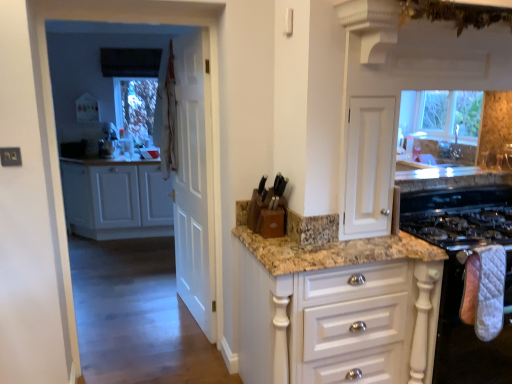
Question: Is white quilted oven mitt at lower right shorter than wooden knife block at center, the 2th appliance in the bottom-to-top sequence?

Choices:
 (A) yes
 (B) no

Answer: (B)

Question: Is white quilted oven mitt at lower right facing towards wooden knife block at center, positioned as the second appliance in right-to-left order?

Choices:
 (A) no
 (B) yes

Answer: (A)

Question: Is white quilted oven mitt at lower right wider than wooden knife block at center, the 2th appliance in the bottom-to-top sequence?

Choices:
 (A) yes
 (B) no

Answer: (B)

Question: Is white quilted oven mitt at lower right touching wooden knife block at center, the 2th appliance in the bottom-to-top sequence?

Choices:
 (A) no
 (B) yes

Answer: (A)

Question: Can you confirm if white quilted oven mitt at lower right is positioned to the right of wooden knife block at center, the 1th appliance positioned from the top?

Choices:
 (A) yes
 (B) no

Answer: (A)

Question: Is the depth of white quilted oven mitt at lower right greater than that of wooden knife block at center, the 2th appliance in the bottom-to-top sequence?

Choices:
 (A) yes
 (B) no

Answer: (B)

Question: Is white quilted oven mitt at lower right touching white fabric curtain at upper left?

Choices:
 (A) yes
 (B) no

Answer: (B)

Question: Can you confirm if white quilted oven mitt at lower right is bigger than white fabric curtain at upper left?

Choices:
 (A) yes
 (B) no

Answer: (B)

Question: Does white quilted oven mitt at lower right turn towards white fabric curtain at upper left?

Choices:
 (A) no
 (B) yes

Answer: (A)

Question: Does white quilted oven mitt at lower right appear on the right side of white fabric curtain at upper left?

Choices:
 (A) no
 (B) yes

Answer: (B)

Question: Considering the relative sizes of white quilted oven mitt at lower right and white fabric curtain at upper left in the image provided, is white quilted oven mitt at lower right smaller than white fabric curtain at upper left?

Choices:
 (A) yes
 (B) no

Answer: (A)

Question: Is the depth of white quilted oven mitt at lower right less than that of white fabric curtain at upper left?

Choices:
 (A) no
 (B) yes

Answer: (B)

Question: Can you see white wood cabinets at left, acting as the first cabinetry starting from the back, touching white glossy cabinet at center, which is counted as the first cabinetry, starting from the front?

Choices:
 (A) yes
 (B) no

Answer: (B)